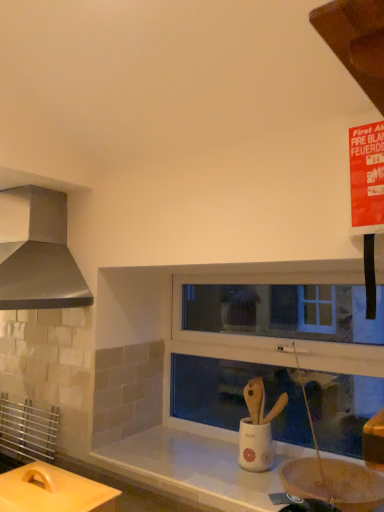
Question: Is white ceramic sink at center outside metallic stainless steel range hood at left?

Choices:
 (A) yes
 (B) no

Answer: (A)

Question: From the image's perspective, is white ceramic sink at center under metallic stainless steel range hood at left?

Choices:
 (A) yes
 (B) no

Answer: (A)

Question: Does white ceramic sink at center appear on the right side of metallic stainless steel range hood at left?

Choices:
 (A) yes
 (B) no

Answer: (A)

Question: Does white ceramic sink at center have a smaller size compared to metallic stainless steel range hood at left?

Choices:
 (A) no
 (B) yes

Answer: (B)

Question: Are white ceramic sink at center and metallic stainless steel range hood at left making contact?

Choices:
 (A) no
 (B) yes

Answer: (A)

Question: Does white ceramic sink at center have a lesser width compared to metallic stainless steel range hood at left?

Choices:
 (A) yes
 (B) no

Answer: (A)

Question: Is the depth of metallic stainless steel range hood at left less than that of matte yellow cutting board at lower left?

Choices:
 (A) no
 (B) yes

Answer: (A)

Question: From a real-world perspective, is metallic stainless steel range hood at left beneath matte yellow cutting board at lower left?

Choices:
 (A) yes
 (B) no

Answer: (B)

Question: From the image's perspective, is metallic stainless steel range hood at left below matte yellow cutting board at lower left?

Choices:
 (A) yes
 (B) no

Answer: (B)

Question: From the image's perspective, is metallic stainless steel range hood at left above matte yellow cutting board at lower left?

Choices:
 (A) yes
 (B) no

Answer: (A)

Question: From a real-world perspective, is metallic stainless steel range hood at left physically above matte yellow cutting board at lower left?

Choices:
 (A) yes
 (B) no

Answer: (A)

Question: Can you confirm if metallic stainless steel range hood at left is wider than matte yellow cutting board at lower left?

Choices:
 (A) yes
 (B) no

Answer: (A)

Question: Considering the relative sizes of white ceramic sink at center and white plastic window frame at center in the image provided, is white ceramic sink at center taller than white plastic window frame at center?

Choices:
 (A) no
 (B) yes

Answer: (A)